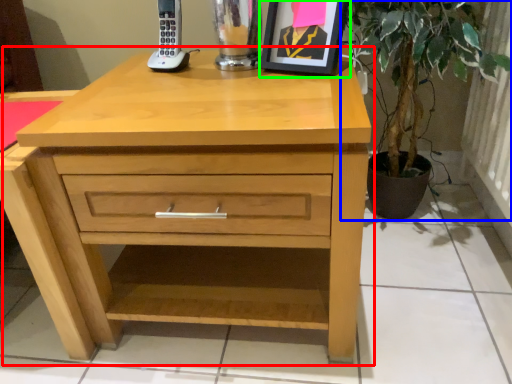
Question: Based on their relative distances, which object is farther from chest of drawers (highlighted by a red box)? Choose from houseplant (highlighted by a blue box) and picture frame (highlighted by a green box).

Choices:
 (A) houseplant
 (B) picture frame

Answer: (A)